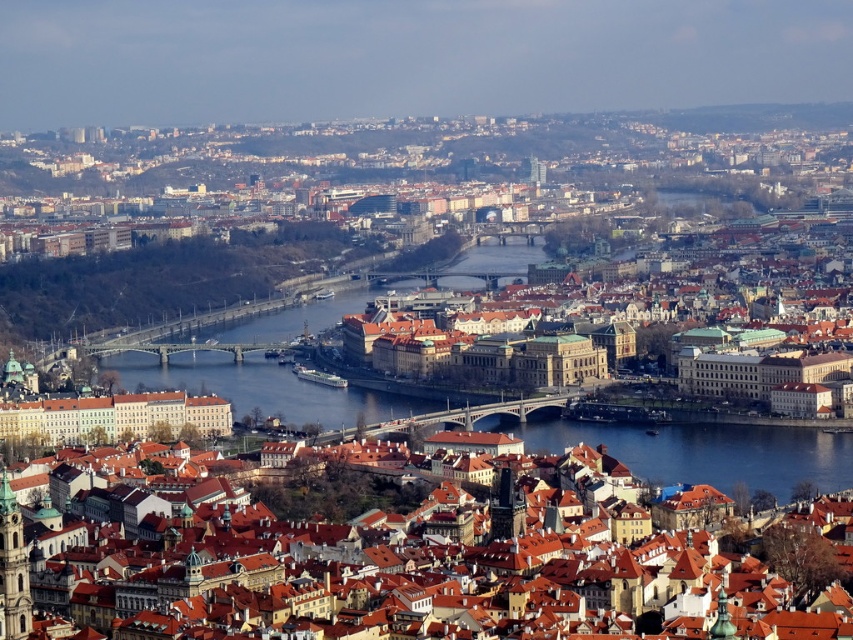
Who is shorter, clear blue water at center or blue glass water at center?

blue glass water at center is shorter.

Consider the image. Does clear blue water at center appear on the left side of blue glass water at center?

Indeed, clear blue water at center is positioned on the left side of blue glass water at center.

Does point (306, 317) come in front of point (654, 445)?

No.

Where is `clear blue water at center`? Image resolution: width=853 pixels, height=640 pixels. clear blue water at center is located at coordinates (262, 387).